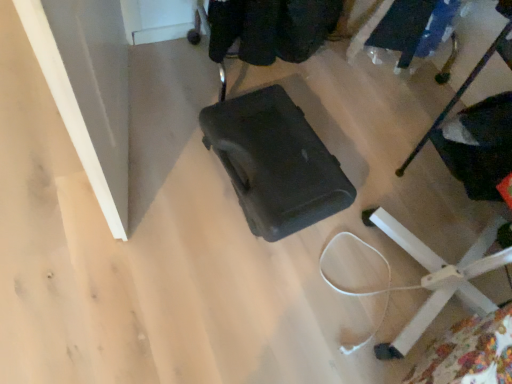
The height and width of the screenshot is (384, 512). Find the location of `white plastic chair at lower right`. white plastic chair at lower right is located at coordinates (438, 278).

What is the approximate width of white plastic chair at lower right?

17.32 inches.

What is the approximate height of white plastic chair at lower right?

white plastic chair at lower right is 25.97 inches in height.

Describe the element at coordinates (438, 278) in the screenshot. I see `white plastic chair at lower right` at that location.

Describe the element at coordinates (275, 162) in the screenshot. Image resolution: width=512 pixels, height=384 pixels. I see `matte black suitcase at center` at that location.

At what (x,y) coordinates should I click in order to perform the action: click on matte black suitcase at center. Please return your answer as a coordinate pair (x, y). Image resolution: width=512 pixels, height=384 pixels. Looking at the image, I should click on (275, 162).

Find the location of a particular element. white plastic chair at lower right is located at coordinates (438, 278).

Consider the image. Can you confirm if matte black suitcase at center is positioned to the left of white plastic chair at lower right?

Indeed, matte black suitcase at center is positioned on the left side of white plastic chair at lower right.

Between matte black suitcase at center and white plastic chair at lower right, which one is positioned in front?

Positioned in front is white plastic chair at lower right.

Is point (302, 194) more distant than point (501, 36)?

That is False.

From the image's perspective, is matte black suitcase at center located beneath white plastic chair at lower right?

Actually, matte black suitcase at center appears above white plastic chair at lower right in the image.

From a real-world perspective, is matte black suitcase at center physically below white plastic chair at lower right?

Yes, from a real-world perspective, matte black suitcase at center is below white plastic chair at lower right.

In the scene shown: Between matte black suitcase at center and white plastic chair at lower right, which one has larger width?

white plastic chair at lower right.

Which of these two, matte black suitcase at center or white plastic chair at lower right, stands shorter?

Standing shorter between the two is matte black suitcase at center.

In terms of size, does matte black suitcase at center appear bigger or smaller than white plastic chair at lower right?

matte black suitcase at center is smaller than white plastic chair at lower right.

Could white plastic chair at lower right be considered to be inside matte black suitcase at center?

Actually, white plastic chair at lower right is outside matte black suitcase at center.

Is matte black suitcase at center placed right next to white plastic chair at lower right?

matte black suitcase at center is not next to white plastic chair at lower right, and they're not touching.

Is matte black suitcase at center oriented towards white plastic chair at lower right?

No, matte black suitcase at center is not facing towards white plastic chair at lower right.

The image size is (512, 384). In order to click on baby carriage behind the white plastic chair at lower right in this screenshot , I will do `click(275, 162)`.

Considering the relative positions of white plastic chair at lower right and matte black suitcase at center in the image provided, is white plastic chair at lower right to the left of matte black suitcase at center from the viewer's perspective?

In fact, white plastic chair at lower right is to the right of matte black suitcase at center.

Based on the photo, relative to matte black suitcase at center, is white plastic chair at lower right in front or behind?

Clearly, white plastic chair at lower right is in front of matte black suitcase at center.

Does point (486, 267) come in front of point (249, 150)?

Yes.

From the image's perspective, is white plastic chair at lower right beneath matte black suitcase at center?

Yes.

From a real-world perspective, is white plastic chair at lower right above or below matte black suitcase at center?

white plastic chair at lower right is above matte black suitcase at center.

Consider the image. Can you confirm if white plastic chair at lower right is wider than matte black suitcase at center?

Yes, white plastic chair at lower right is wider than matte black suitcase at center.

In terms of height, does white plastic chair at lower right look taller or shorter compared to matte black suitcase at center?

Clearly, white plastic chair at lower right is taller compared to matte black suitcase at center.

Considering the sizes of white plastic chair at lower right and matte black suitcase at center in the image, is white plastic chair at lower right bigger or smaller than matte black suitcase at center?

In the image, white plastic chair at lower right appears to be larger than matte black suitcase at center.

Is matte black suitcase at center located within white plastic chair at lower right?

No, matte black suitcase at center is not a part of white plastic chair at lower right.

In the scene shown: Is white plastic chair at lower right next to matte black suitcase at center?

No.

Could you tell me if white plastic chair at lower right is facing matte black suitcase at center?

Yes.

Find the location of a particular element. This screenshot has height=384, width=512. furniture that is in front of the matte black suitcase at center is located at coordinates (438, 278).

There is a matte black suitcase at center. Identify the location of furniture above it (from a real-world perspective). Image resolution: width=512 pixels, height=384 pixels. (438, 278).

Where is `furniture in front of the matte black suitcase at center`? Image resolution: width=512 pixels, height=384 pixels. furniture in front of the matte black suitcase at center is located at coordinates (438, 278).